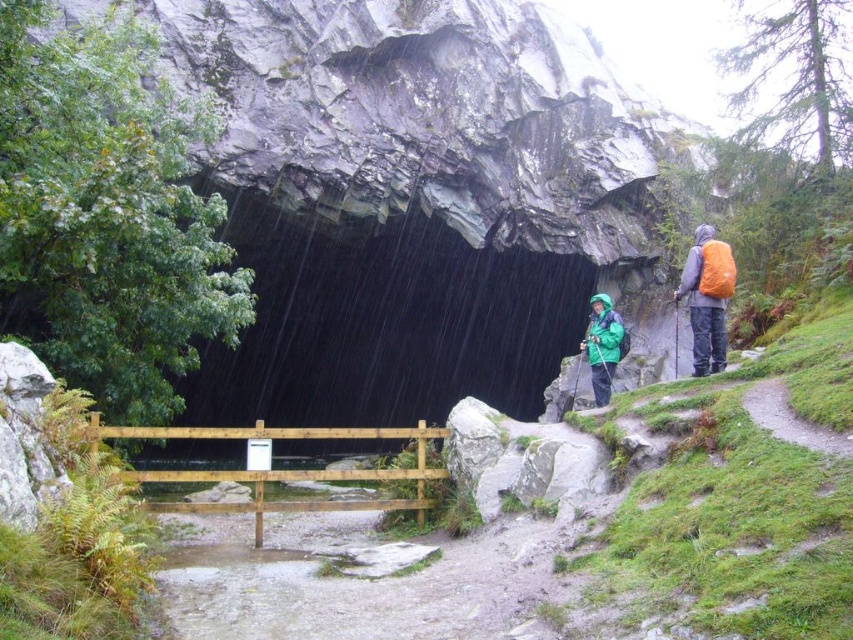
Does point (550, 310) lie behind point (721, 292)?

That is True.

Which is above, dark gray stone cave at center or orange backpack at right?

orange backpack at right is above.

Describe the element at coordinates (381, 321) in the screenshot. I see `dark gray stone cave at center` at that location.

In order to click on dark gray stone cave at center in this screenshot , I will do `click(381, 321)`.

Does dark gray stone cave at center have a larger size compared to green matte jacket at center?

Yes, dark gray stone cave at center is bigger than green matte jacket at center.

Can you confirm if dark gray stone cave at center is positioned above green matte jacket at center?

No.

Is point (387, 337) positioned behind point (590, 308)?

Yes, point (387, 337) is behind point (590, 308).

Locate an element on the screen. dark gray stone cave at center is located at coordinates (381, 321).

Which is below, dark gray stone cave at center or green waterproof jacket at center?

Positioned lower is dark gray stone cave at center.

Can you confirm if dark gray stone cave at center is shorter than green waterproof jacket at center?

In fact, dark gray stone cave at center may be taller than green waterproof jacket at center.

Does point (415, 337) come behind point (704, 262)?

Yes.

Locate an element on the screen. dark gray stone cave at center is located at coordinates (381, 321).